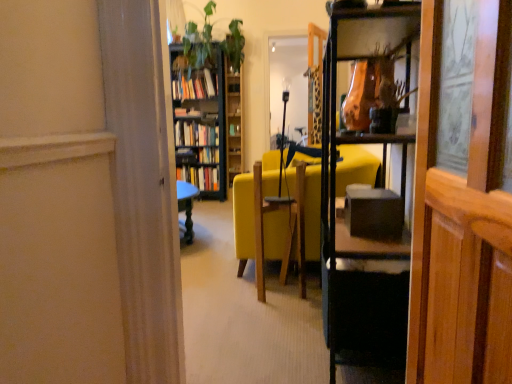
In order to click on vacant area situated below wooden swivel chair at center (from a real-world perspective) in this screenshot , I will do `click(282, 288)`.